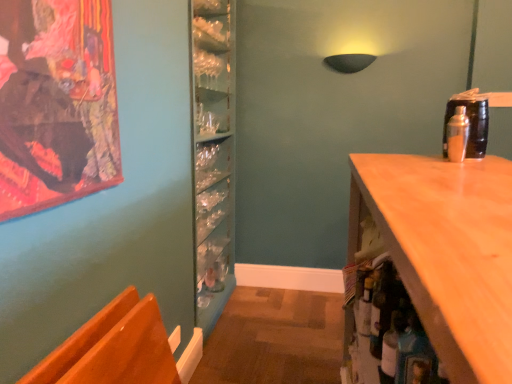
Question: Would you say shiny orange chair at lower left is inside or outside translucent glass bottle at lower right, the second bottle positioned from the back?

Choices:
 (A) inside
 (B) outside

Answer: (B)

Question: From a real-world perspective, is shiny orange chair at lower left positioned above or below translucent glass bottle at lower right, which appears as the 1th bottle when viewed from the left?

Choices:
 (A) below
 (B) above

Answer: (A)

Question: Estimate the real-world distances between objects in this image. Which object is closer to the metallic silver shaker at upper right, arranged as the first bottle when viewed from the right?

Choices:
 (A) translucent glass bottle at lower right, which appears as the first bottle when ordered from the bottom
 (B) shiny orange chair at lower left

Answer: (A)

Question: Estimate the real-world distances between objects in this image. Which object is farther from the metallic silver shaker at upper right, the second bottle ordered from the bottom?

Choices:
 (A) translucent glass bottle at lower right, the second bottle positioned from the back
 (B) shiny orange chair at lower left

Answer: (B)